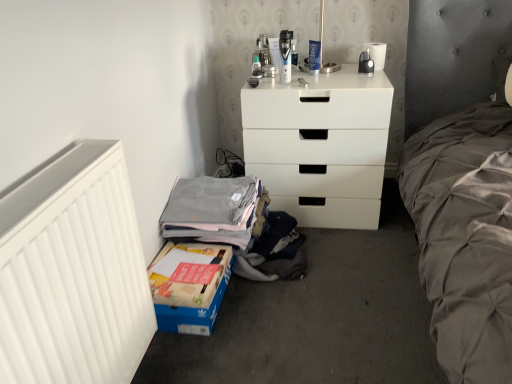
Question: Is white matte chest of drawers at center at the left side of white matte radiator at left?

Choices:
 (A) yes
 (B) no

Answer: (B)

Question: From a real-world perspective, is white matte chest of drawers at center positioned under white matte radiator at left based on gravity?

Choices:
 (A) yes
 (B) no

Answer: (A)

Question: Considering the relative sizes of white matte chest of drawers at center and white matte radiator at left in the image provided, is white matte chest of drawers at center shorter than white matte radiator at left?

Choices:
 (A) no
 (B) yes

Answer: (B)

Question: Is white matte radiator at left at the back of white matte chest of drawers at center?

Choices:
 (A) no
 (B) yes

Answer: (A)

Question: Considering the relative sizes of white matte chest of drawers at center and white matte radiator at left in the image provided, is white matte chest of drawers at center wider than white matte radiator at left?

Choices:
 (A) no
 (B) yes

Answer: (B)

Question: Is white matte radiator at left taller or shorter than white matte chest of drawers at center?

Choices:
 (A) tall
 (B) short

Answer: (A)

Question: From the image's perspective, is white matte radiator at left above or below white matte chest of drawers at center?

Choices:
 (A) above
 (B) below

Answer: (B)

Question: Is white matte radiator at left wider or thinner than white matte chest of drawers at center?

Choices:
 (A) thin
 (B) wide

Answer: (A)

Question: In the image, is white matte radiator at left positioned in front of or behind white matte chest of drawers at center?

Choices:
 (A) behind
 (B) front

Answer: (B)

Question: Considering the positions of point (281, 76) and point (57, 291), is point (281, 76) closer or farther from the camera than point (57, 291)?

Choices:
 (A) farther
 (B) closer

Answer: (A)

Question: Do you think matte plastic shaver at upper center is within white matte radiator at left, or outside of it?

Choices:
 (A) inside
 (B) outside

Answer: (B)

Question: In terms of width, does matte plastic shaver at upper center look wider or thinner when compared to white matte radiator at left?

Choices:
 (A) wide
 (B) thin

Answer: (B)

Question: Considering the relative positions of matte plastic shaver at upper center and white matte radiator at left in the image provided, is matte plastic shaver at upper center to the left or to the right of white matte radiator at left?

Choices:
 (A) left
 (B) right

Answer: (B)

Question: Would you say matte plastic shaver at upper center is inside or outside white matte chest of drawers at center?

Choices:
 (A) inside
 (B) outside

Answer: (B)

Question: From the image's perspective, is matte plastic shaver at upper center located above or below white matte chest of drawers at center?

Choices:
 (A) below
 (B) above

Answer: (B)